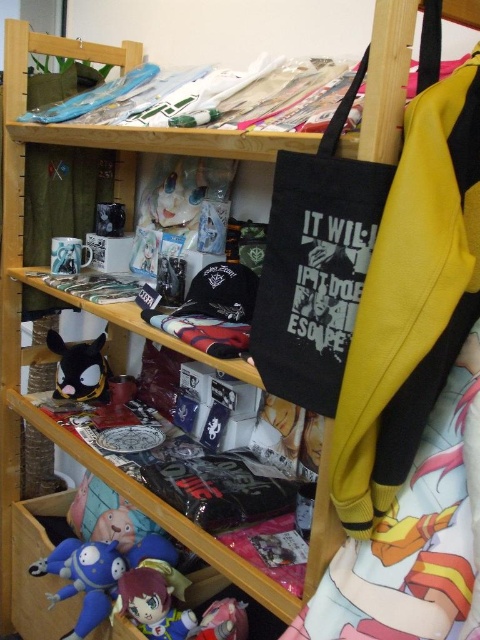
You are a customer in the store and want to grab both the matte black plush toy at lower left and the matte pink plush at lower center. If your arms can reach 28 inches, can you grab both without moving your arms?

The matte black plush toy at lower left is 27.34 inches away from the matte pink plush at lower center. Since your arms can reach 28 inches, you can grab both without moving your arms.